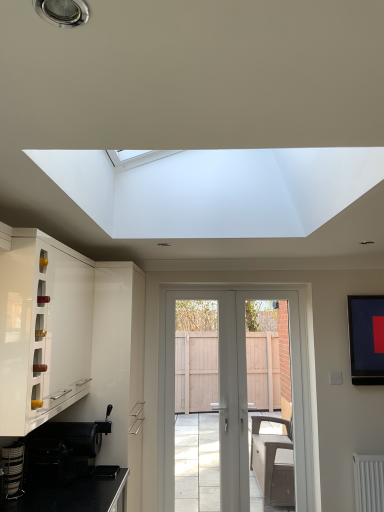
Question: From the image's perspective, is white glossy cabinet at left located above or below metallic silver coffee machine at lower left?

Choices:
 (A) above
 (B) below

Answer: (A)

Question: Is white glossy cabinet at left in front of or behind metallic silver coffee machine at lower left in the image?

Choices:
 (A) front
 (B) behind

Answer: (A)

Question: Estimate the real-world distances between objects in this image. Which object is closer to the white plastic screen door at center?

Choices:
 (A) white glossy door at center
 (B) white glossy cabinet at left
 (C) metallic silver coffee machine at lower left

Answer: (A)

Question: Which is nearer to the metallic silver coffee machine at lower left?

Choices:
 (A) white plastic screen door at center
 (B) white glossy door at center
 (C) white glossy cabinet at left

Answer: (C)